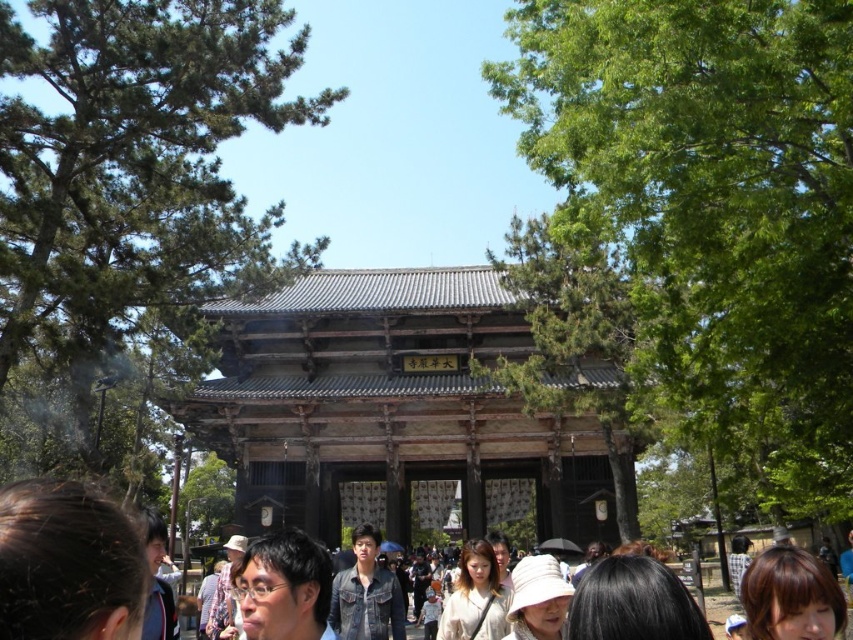
You are a photographer standing in front of the temple gate. You want to take a photo that includes both the brown hair at lower left and the light brown wooden hat at lower center. Which object should you focus on first to ensure both are in sharp focus?

You should focus on the brown hair at lower left first because it is closer to the viewer than the light brown wooden hat at lower center. By focusing on the closer object, the background object will still be in focus due to the depth of field.

You are a photographer standing at the center of the scene. You want to capture a photo of the brown hair at lower left without including the temple gate in the background. Is the point where the brown hair is located at point (67,563) far enough from the temple gate to avoid it in the shot?

The brown hair at lower left is located at point (67,563), which is far enough from the temple gate to avoid it in the background of the photo.

You are a photographer standing in front of the temple gate. You want to capture a photo of the brown hair at lower left and the light brown wooden hat at lower center in the same frame. Based on their positions, which object should you focus on first to ensure both are in focus?

The brown hair at lower left is above the light brown wooden hat at lower center, so you should focus on the brown hair at lower left first to ensure both are in focus.